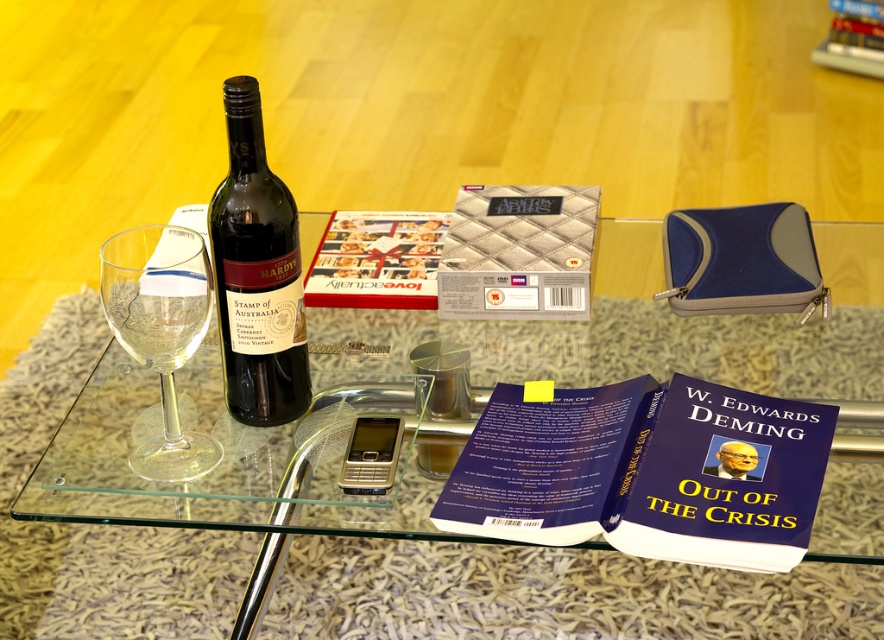
Does point (218, 189) come closer to viewer compared to point (172, 228)?

Yes, point (218, 189) is closer to viewer.

Is point (237, 396) closer to viewer compared to point (195, 340)?

No, it is behind (195, 340).

What are the coordinates of `matte glass wine bottle at center` in the screenshot? It's located at (257, 273).

Can you confirm if transparent glass table at center is smaller than transparent glass wine glass at left?

Incorrect, transparent glass table at center is not smaller in size than transparent glass wine glass at left.

Is transparent glass table at center taller than transparent glass wine glass at left?

Correct, transparent glass table at center is much taller as transparent glass wine glass at left.

You are a GUI agent. You are given a task and a screenshot of the screen. Output one action in this format:
    pyautogui.click(x=<x>, y=<y>)
    Task: Click on the transparent glass table at center
    
    Given the screenshot: What is the action you would take?
    pyautogui.click(x=645, y=348)

Does transparent glass wine glass at left have a smaller size compared to hardcover book at center?

Correct, transparent glass wine glass at left occupies less space than hardcover book at center.

Does transparent glass wine glass at left appear over hardcover book at center?

Actually, transparent glass wine glass at left is below hardcover book at center.

Is point (171, 385) behind point (416, 241)?

That is False.

In order to click on transparent glass wine glass at left in this screenshot , I will do `click(161, 332)`.